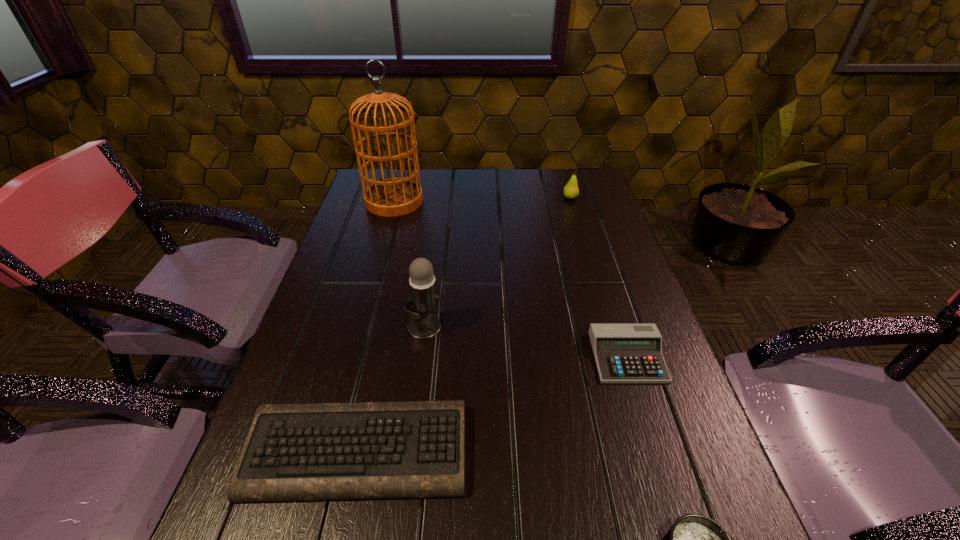
I want to click on vacant position in the image that satisfies the following two spatial constraints: 1. on the front side of the microphone; 2. on the left side of the calculator, so click(420, 357).

The width and height of the screenshot is (960, 540). In order to click on vacant space that satisfies the following two spatial constraints: 1. on the front side of the calculator; 2. on the left side of the tallest object in this screenshot , I will do `click(350, 357)`.

Locate an element on the screen. The width and height of the screenshot is (960, 540). vacant space that satisfies the following two spatial constraints: 1. on the back side of the microphone; 2. on the right side of the fifth farthest object is located at coordinates (385, 326).